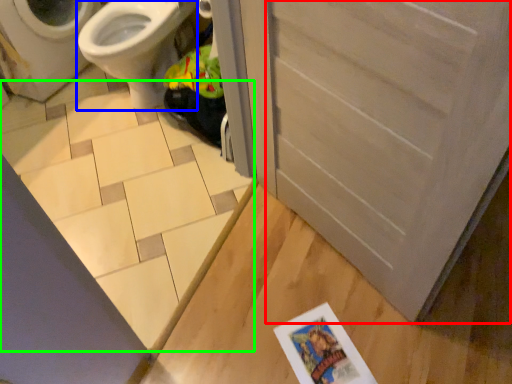
Question: Which is farther away from screen door (highlighted by a red box)? bidet (highlighted by a blue box) or tile (highlighted by a green box)?

Choices:
 (A) bidet
 (B) tile

Answer: (A)